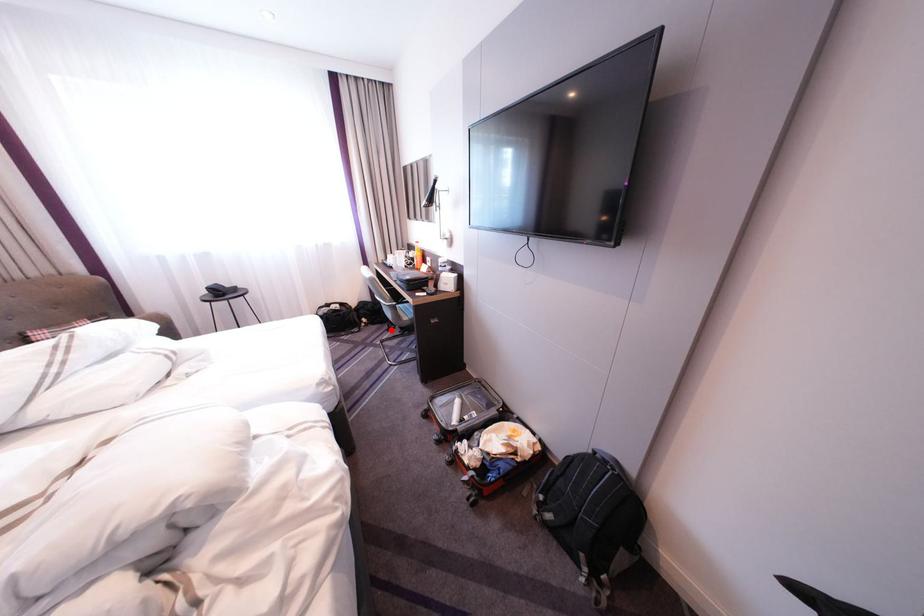
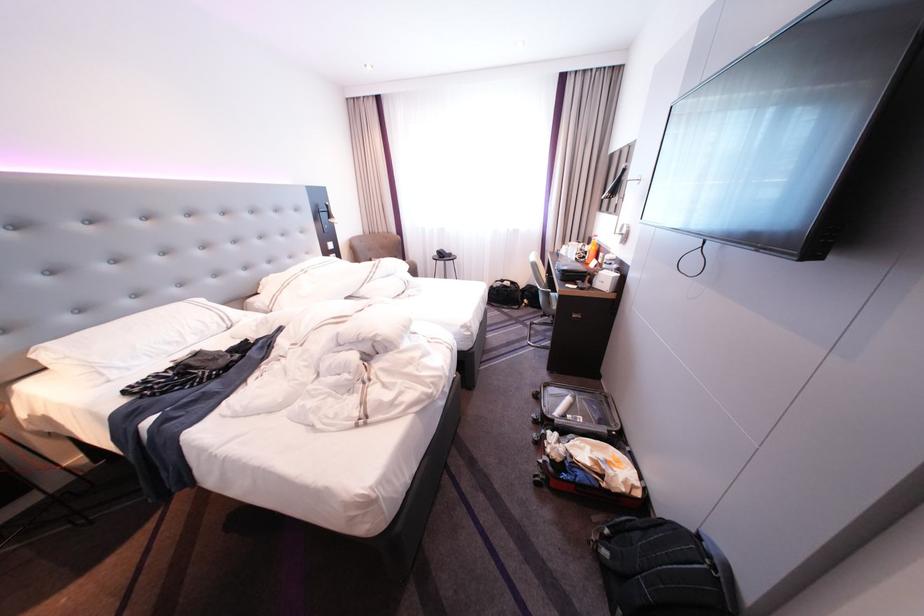
Question: I am providing you with two images of the same scene from different viewpoints. A red point is shown in image1. For the corresponding object point in image2, is it positioned nearer or farther from the camera?

Choices:
 (A) Nearer
 (B) Farther

Answer: (A)